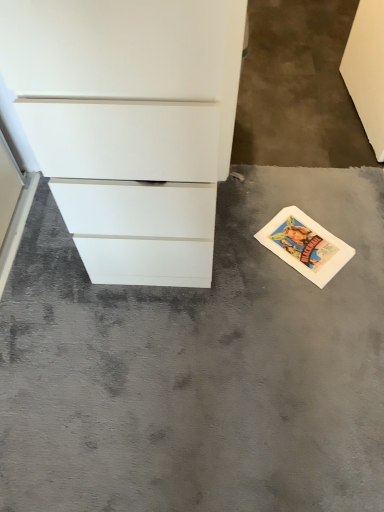
Find the location of a particular element. vacant space to the right of white paper postcard at lower right is located at coordinates (361, 231).